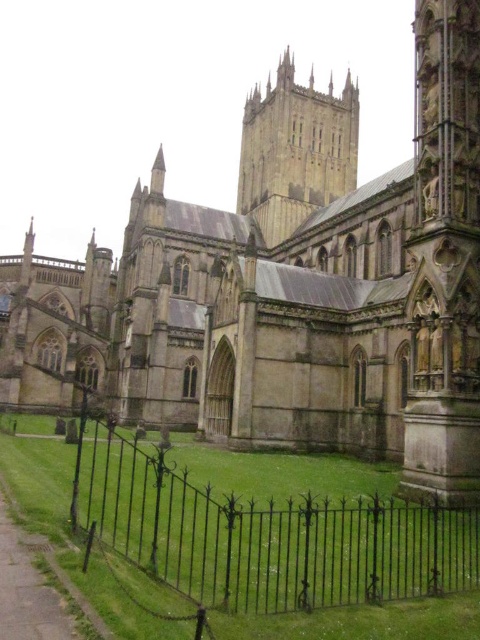
You are a visitor standing at the entrance of the cathedral. You see the black wrought iron fence at lower center and the stone tower at center. Which object is taller?

The stone tower at center is taller than the black wrought iron fence at lower center.

You are standing at the entrance of the cathedral and want to walk towards the black wrought iron fence at lower center. What coordinates should you head towards?

You should head towards the coordinates point (265, 536) where the black wrought iron fence at lower center is located.

You are standing in front of the cathedral and want to determine which of the two points, point (95,449) or point (343,173), is closer to you. Based on the scene, which point is nearer?

Point (95,449) is closer to the viewer than point (343,173).